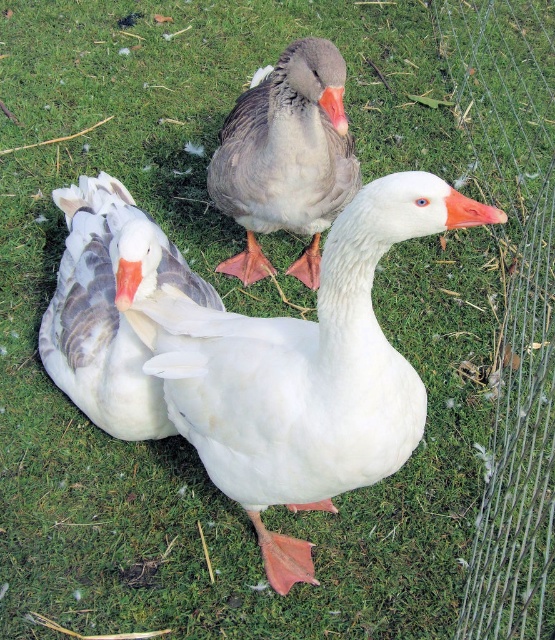
You are standing in a field and see the wire mesh fence at right and the gray matte goose at center. Which object is located to the east?

The wire mesh fence at right is positioned on the right side of gray matte goose at center, so if you are facing the geese, the wire mesh fence at right is to the east of the gray matte goose at center.

You are a small dog trying to jump over the wire mesh fence at right while avoiding the white matte goose at center. Can you clear the fence without getting too close to the goose?

The wire mesh fence at right is taller than the white matte goose at center, so the small dog would need to jump higher to clear the fence. However, since the goose is at the center, the dog should approach from the side to avoid getting too close.